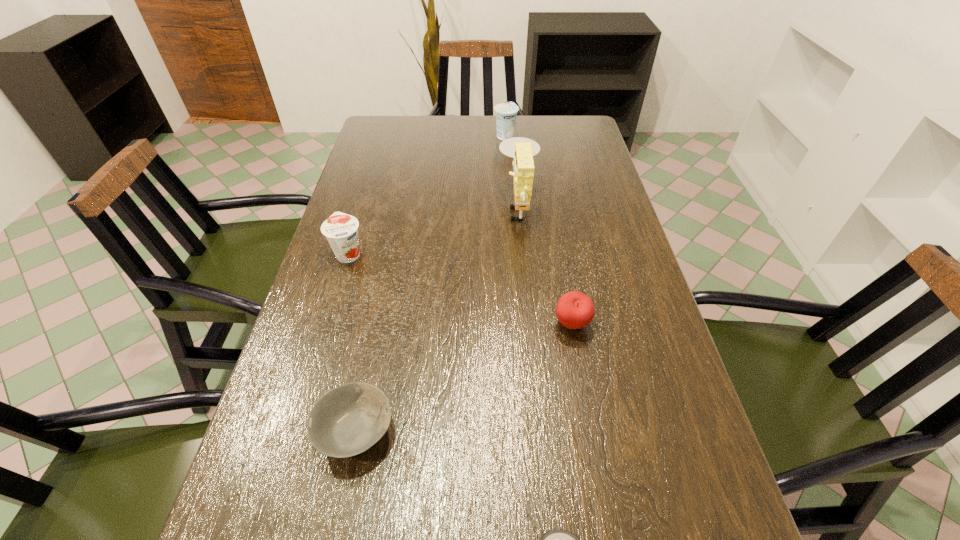
This screenshot has width=960, height=540. I want to click on free region located on the front-facing side of the second farthest object, so click(392, 205).

I want to click on blank area located 0.400m on the front of the farthest yogurt, so click(512, 215).

Image resolution: width=960 pixels, height=540 pixels. I want to click on vacant space located on the right of the fourth nearest object, so click(x=460, y=253).

The width and height of the screenshot is (960, 540). Identify the location of free space located 0.270m on the front of the apple. (597, 467).

This screenshot has width=960, height=540. What are the coordinates of `vacant space located 0.130m on the back of the bowl` in the screenshot? It's located at (373, 340).

I want to click on object positioned at the far edge, so click(506, 113).

You are a GUI agent. You are given a task and a screenshot of the screen. Output one action in this format:
    pyautogui.click(x=<x>, y=<y>)
    Task: Click on the yogurt that is at the left edge
    This screenshot has height=540, width=960.
    Given the screenshot: What is the action you would take?
    pyautogui.click(x=341, y=230)

Locate an element on the screen. This screenshot has width=960, height=540. bowl present at the left edge is located at coordinates (349, 419).

I want to click on object that is at the right edge, so click(x=574, y=310).

In the image, there is a desktop. Identify the location of vacant space at the far edge. The width and height of the screenshot is (960, 540). (455, 122).